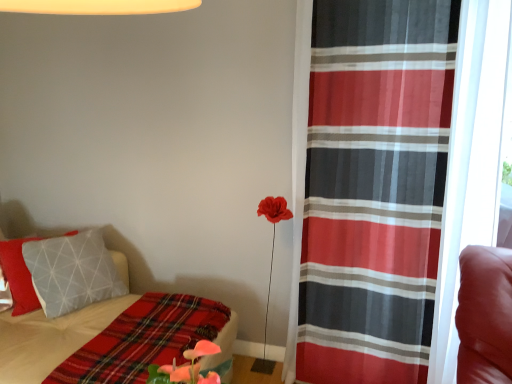
At what (x,y) coordinates should I click in order to perform the action: click on plaid fabric bed at lower left. Please return your answer as a coordinate pair (x, y). The height and width of the screenshot is (384, 512). Looking at the image, I should click on (42, 339).

Measure the distance between plaid fabric blanket at lower left and camera.

1.19 meters.

In order to click on red sheer curtain at right in this screenshot , I will do `click(374, 188)`.

Find the location of `plaid fabric bed at lower left`. plaid fabric bed at lower left is located at coordinates (42, 339).

Is plaid fabric blanket at lower left further to camera compared to plaid fabric bed at lower left?

Yes, it is behind plaid fabric bed at lower left.

Does point (127, 323) appear closer or farther from the camera than point (67, 325)?

Point (127, 323) is positioned closer to the camera compared to point (67, 325).

Which of these two, plaid fabric bed at lower left or plaid fabric blanket at lower left, is bigger?

plaid fabric bed at lower left.

From a real-world perspective, is plaid fabric bed at lower left located higher than plaid fabric blanket at lower left?

No, from a real-world perspective, plaid fabric bed at lower left is not over plaid fabric blanket at lower left

Who is taller, plaid fabric bed at lower left or plaid fabric blanket at lower left?

plaid fabric bed at lower left.

Is red sheer curtain at right completely or partially outside of plaid fabric blanket at lower left?

Indeed, red sheer curtain at right is completely outside plaid fabric blanket at lower left.

Which point is more distant from viewer, (361, 375) or (202, 316)?

The point (361, 375) is farther.

Which object is positioned more to the right, red sheer curtain at right or plaid fabric blanket at lower left?

red sheer curtain at right.

From their relative heights in the image, would you say red sheer curtain at right is taller or shorter than plaid fabric blanket at lower left?

In the image, red sheer curtain at right appears to be taller than plaid fabric blanket at lower left.

Is plaid fabric blanket at lower left next to red sheer curtain at right and touching it?

plaid fabric blanket at lower left and red sheer curtain at right are clearly separated.

Is plaid fabric blanket at lower left taller than red sheer curtain at right?

In fact, plaid fabric blanket at lower left may be shorter than red sheer curtain at right.

Does point (99, 367) come farther from viewer compared to point (369, 368)?

No, (99, 367) is closer to viewer.

Between plaid fabric blanket at lower left and red sheer curtain at right, which one appears on the right side from the viewer's perspective?

red sheer curtain at right is more to the right.

Does red sheer curtain at right have a greater height compared to plaid fabric bed at lower left?

Indeed, red sheer curtain at right has a greater height compared to plaid fabric bed at lower left.

Is there a large distance between red sheer curtain at right and plaid fabric bed at lower left?

red sheer curtain at right is far away from plaid fabric bed at lower left.

Is red sheer curtain at right oriented towards plaid fabric bed at lower left?

No, red sheer curtain at right is not facing towards plaid fabric bed at lower left.

Locate an element on the screen. This screenshot has width=512, height=384. bed on the left of the red sheer curtain at right is located at coordinates (42, 339).

Could red sheer curtain at right be considered to be inside plaid fabric bed at lower left?

No, red sheer curtain at right is not inside plaid fabric bed at lower left.

Is plaid fabric bed at lower left in contact with red sheer curtain at right?

No, plaid fabric bed at lower left is not beside red sheer curtain at right.

Which is in front, plaid fabric bed at lower left or red sheer curtain at right?

plaid fabric bed at lower left.

Where is `blanket on the right of plaid fabric bed at lower left`? This screenshot has height=384, width=512. blanket on the right of plaid fabric bed at lower left is located at coordinates (143, 339).

The width and height of the screenshot is (512, 384). There is a plaid fabric bed at lower left. In order to click on blanket above it (from a real-world perspective) in this screenshot , I will do `click(143, 339)`.

Consider the image. Based on their spatial positions, is plaid fabric bed at lower left or plaid fabric blanket at lower left further from red sheer curtain at right?

Based on the image, plaid fabric bed at lower left appears to be further to red sheer curtain at right.

Which object lies nearer to the anchor point plaid fabric bed at lower left, plaid fabric blanket at lower left or red sheer curtain at right?

plaid fabric blanket at lower left.

Looking at the image, which one is located closer to red sheer curtain at right, plaid fabric blanket at lower left or plaid fabric bed at lower left?

plaid fabric blanket at lower left is positioned closer to the anchor red sheer curtain at right.

Looking at the image, which one is located further to plaid fabric blanket at lower left, red sheer curtain at right or plaid fabric bed at lower left?

red sheer curtain at right is further to plaid fabric blanket at lower left.

Looking at the image, which one is located further to plaid fabric blanket at lower left, plaid fabric bed at lower left or red sheer curtain at right?

red sheer curtain at right lies further to plaid fabric blanket at lower left than the other object.

Estimate the real-world distances between objects in this image. Which object is further from plaid fabric bed at lower left, red sheer curtain at right or plaid fabric blanket at lower left?

red sheer curtain at right.

The image size is (512, 384). Identify the location of blanket situated between plaid fabric bed at lower left and red sheer curtain at right from left to right. (143, 339).